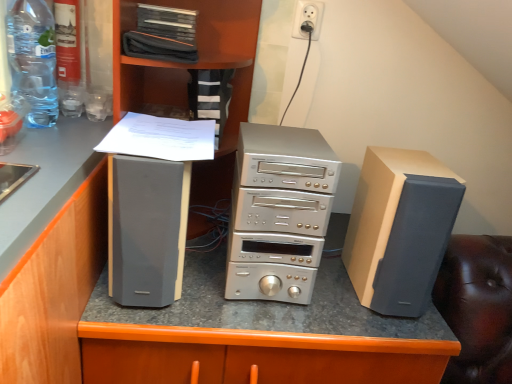
The height and width of the screenshot is (384, 512). I want to click on transparent plastic bottle at upper left, so click(33, 60).

The image size is (512, 384). What do you see at coordinates (175, 62) in the screenshot? I see `black fabric case at upper center` at bounding box center [175, 62].

The image size is (512, 384). What are the coordinates of `matte beige computer tower at right` in the screenshot? It's located at (400, 229).

What do you see at coordinates (308, 19) in the screenshot?
I see `white plastic socket at upper center` at bounding box center [308, 19].

Identify the location of white plastic socket at upper center. The width and height of the screenshot is (512, 384). (308, 19).

What is the approximate height of matte black speaker at left?

matte black speaker at left is 63.93 centimeters tall.

What do you see at coordinates (189, 76) in the screenshot? I see `matte black speaker at left` at bounding box center [189, 76].

Where is `satin silver electronics at center`? The width and height of the screenshot is (512, 384). satin silver electronics at center is located at coordinates (259, 335).

Is black fabric case at upper center positioned far away from silver metallic stereo stack at center?

black fabric case at upper center is near silver metallic stereo stack at center, not far away.

Considering the sizes of black fabric case at upper center and silver metallic stereo stack at center in the image, is black fabric case at upper center wider or thinner than silver metallic stereo stack at center?

In the image, black fabric case at upper center appears to be wider than silver metallic stereo stack at center.

How many degrees apart are the facing directions of black fabric case at upper center and silver metallic stereo stack at center?

The angular difference between black fabric case at upper center and silver metallic stereo stack at center is 0.000722 degrees.

Consider the image. Considering the sizes of objects black fabric case at upper center and silver metallic stereo stack at center in the image provided, who is smaller, black fabric case at upper center or silver metallic stereo stack at center?

black fabric case at upper center.

Who is smaller, matte black speaker at left or silver metallic stereo stack at center?

silver metallic stereo stack at center.

Is matte black speaker at left shorter than silver metallic stereo stack at center?

In fact, matte black speaker at left may be taller than silver metallic stereo stack at center.

Is matte black speaker at left looking in the opposite direction of silver metallic stereo stack at center?

No, matte black speaker at left is not facing the opposite direction of silver metallic stereo stack at center.

Consider the image. Is satin silver electronics at center bigger than matte black speaker at left?

Indeed, satin silver electronics at center has a larger size compared to matte black speaker at left.

From the image's perspective, which object appears higher, satin silver electronics at center or matte black speaker at left?

matte black speaker at left is shown above in the image.

Based on their positions, is satin silver electronics at center located to the left or right of matte black speaker at left?

Clearly, satin silver electronics at center is on the right of matte black speaker at left in the image.

Does silver metallic stereo stack at center have a greater height compared to matte wood cabinet at left?

Incorrect, the height of silver metallic stereo stack at center is not larger of that of matte wood cabinet at left.

From the image's perspective, which object appears higher, silver metallic stereo stack at center or matte wood cabinet at left?

From the image's view, silver metallic stereo stack at center is above.

Between silver metallic stereo stack at center and matte wood cabinet at left, which one has smaller width?

With smaller width is silver metallic stereo stack at center.

This screenshot has height=384, width=512. I want to click on home appliance behind the matte wood cabinet at left, so click(x=279, y=212).

Is matte black speaker at left bigger than black fabric case at upper center?

Indeed, matte black speaker at left has a larger size compared to black fabric case at upper center.

Is matte black speaker at left wider or thinner than black fabric case at upper center?

Clearly, matte black speaker at left has more width compared to black fabric case at upper center.

From the image's perspective, which one is positioned higher, matte black speaker at left or black fabric case at upper center?

black fabric case at upper center is shown above in the image.

Can you tell me how much matte black speaker at left and black fabric case at upper center differ in facing direction?

The angular difference between matte black speaker at left and black fabric case at upper center is 0.000438 degrees.

Is matte beige computer tower at right touching white paper at center?

No, matte beige computer tower at right is not beside white paper at center.

Which is more to the left, matte beige computer tower at right or white paper at center?

white paper at center.

Can you confirm if matte beige computer tower at right is thinner than white paper at center?

Yes, matte beige computer tower at right is thinner than white paper at center.

Which object is closer to the camera taking this photo, matte beige computer tower at right or white paper at center?

white paper at center is in front.

Can you tell me how much matte beige computer tower at right and matte gray speaker at left differ in facing direction?

The angular difference between matte beige computer tower at right and matte gray speaker at left is 0.000304 degrees.

Is matte beige computer tower at right outside of matte gray speaker at left?

Yes, matte beige computer tower at right is located beyond the bounds of matte gray speaker at left.

Is matte beige computer tower at right facing towards matte gray speaker at left?

No, matte beige computer tower at right does not turn towards matte gray speaker at left.

Locate an element on the screen. This screenshot has width=512, height=384. shelf that is above the silver metallic stereo stack at center (from the image's perspective) is located at coordinates (175, 62).

The height and width of the screenshot is (384, 512). What are the coordinates of `home appliance on the right side of matte black speaker at left` in the screenshot? It's located at (279, 212).

Estimate the real-world distances between objects in this image. Which object is further from silver metallic stereo stack at center, matte gray speaker at left or white paper at center?

The object further to silver metallic stereo stack at center is matte gray speaker at left.

Considering their positions, is matte wood cabinet at left positioned closer to white paper at center than matte beige computer tower at right?

matte wood cabinet at left is positioned closer to the anchor white paper at center.

Estimate the real-world distances between objects in this image. Which object is closer to satin silver electronics at center, white plastic socket at upper center or matte gray speaker at left?

Among the two, matte gray speaker at left is located nearer to satin silver electronics at center.

From the image, which object appears to be farther from matte beige computer tower at right, white plastic socket at upper center or satin silver electronics at center?

white plastic socket at upper center.

Looking at this image, estimate the real-world distances between objects in this image. Which object is closer to matte wood cabinet at left, matte gray speaker at left or silver metallic stereo stack at center?

matte gray speaker at left lies closer to matte wood cabinet at left than the other object.

Looking at this image, from the image, which object appears to be farther from matte wood cabinet at left, silver metallic stereo stack at center or satin silver electronics at center?

The object further to matte wood cabinet at left is silver metallic stereo stack at center.

When comparing their distances from silver metallic stereo stack at center, does white paper at center or matte black speaker at left seem closer?

white paper at center lies closer to silver metallic stereo stack at center than the other object.

Looking at the image, which one is located further to matte beige computer tower at right, silver metallic stereo stack at center or white plastic socket at upper center?

white plastic socket at upper center.

Locate an element on the screen. Image resolution: width=512 pixels, height=384 pixels. shelf between transparent plastic bottle at upper left and matte beige computer tower at right in the horizontal direction is located at coordinates (175, 62).

This screenshot has height=384, width=512. Identify the location of shelf situated between transparent plastic bottle at upper left and silver metallic stereo stack at center from left to right. (175, 62).

Where is `home appliance between matte gray speaker at left and matte beige computer tower at right from left to right`? home appliance between matte gray speaker at left and matte beige computer tower at right from left to right is located at coordinates (279, 212).

Where is `bookshelf between matte wood cabinet at left and silver metallic stereo stack at center`? This screenshot has height=384, width=512. bookshelf between matte wood cabinet at left and silver metallic stereo stack at center is located at coordinates (189, 76).